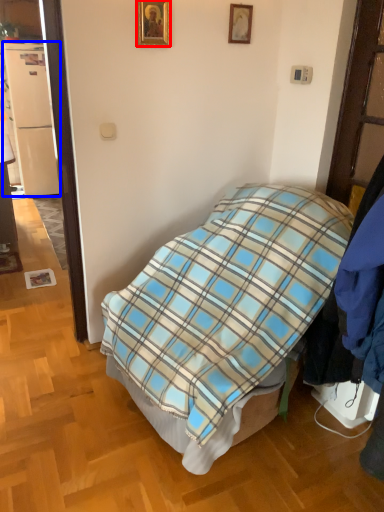
Question: Which object appears closest to the camera in this image, picture frame (highlighted by a red box) or refrigerator (highlighted by a blue box)?

Choices:
 (A) picture frame
 (B) refrigerator

Answer: (A)